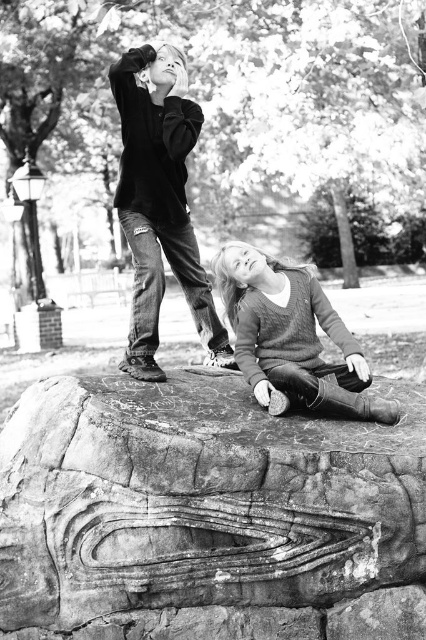
Question: From the image, what is the correct spatial relationship of rough stone carving at center in relation to ripped denim jeans at upper center?

Choices:
 (A) left
 (B) right

Answer: (B)

Question: Which is farther from the knit sweater at center?

Choices:
 (A) rough stone carving at center
 (B) ripped denim jeans at upper center

Answer: (A)

Question: Which object is farther from the camera taking this photo?

Choices:
 (A) rough stone carving at center
 (B) knit sweater at center
 (C) dark cotton sweater at upper left
 (D) ripped denim jeans at upper center

Answer: (C)

Question: Does rough stone carving at center have a smaller size compared to dark cotton sweater at upper left?

Choices:
 (A) yes
 (B) no

Answer: (B)

Question: Which point appears farthest from the camera in this image?

Choices:
 (A) (218, 282)
 (B) (166, 60)

Answer: (A)

Question: Does rough stone carving at center appear under ripped denim jeans at upper center?

Choices:
 (A) no
 (B) yes

Answer: (B)